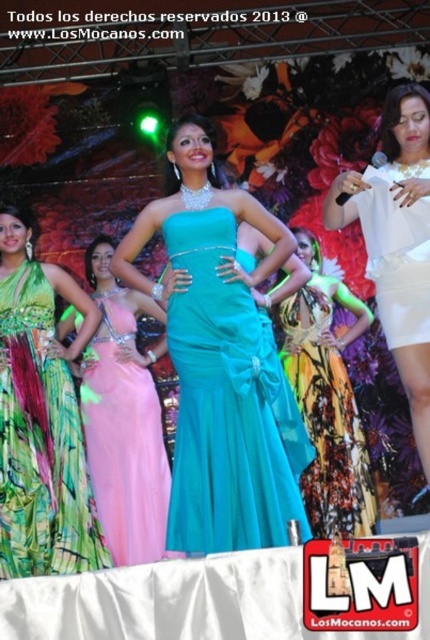
You are a photographer at the event and need to capture a photo where both the pink satin dress at center and the white satin dress at center are clearly visible. Based on their positions, which dress is lower in the frame?

The pink satin dress at center is positioned under the white satin dress at center, so the pink one is lower in the frame.